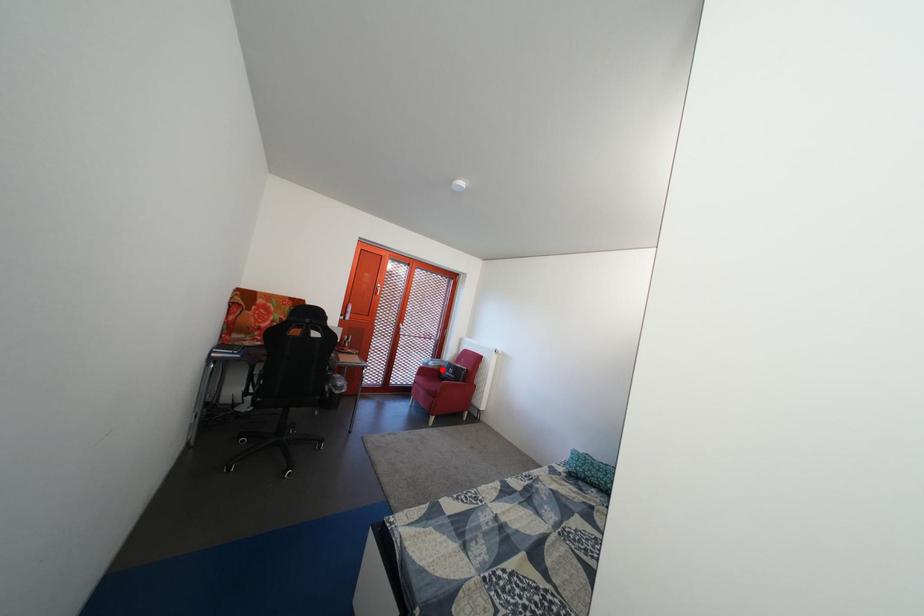
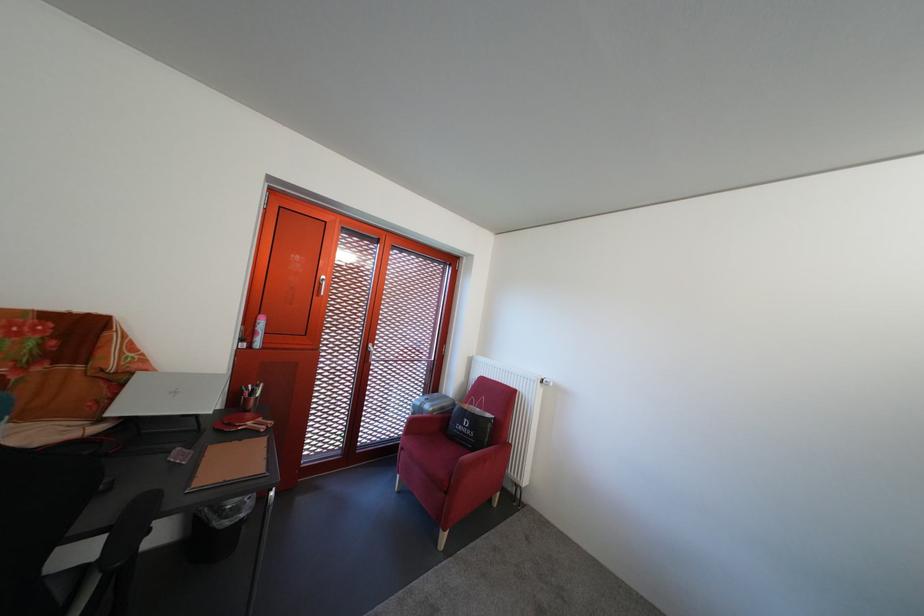
Question: I am providing you with two images of the same scene from different viewpoints. Given a red point in image1, look at the same physical point in image2. Is it:

Choices:
 (A) Closer to the viewpoint
 (B) Farther from the viewpoint

Answer: (A)